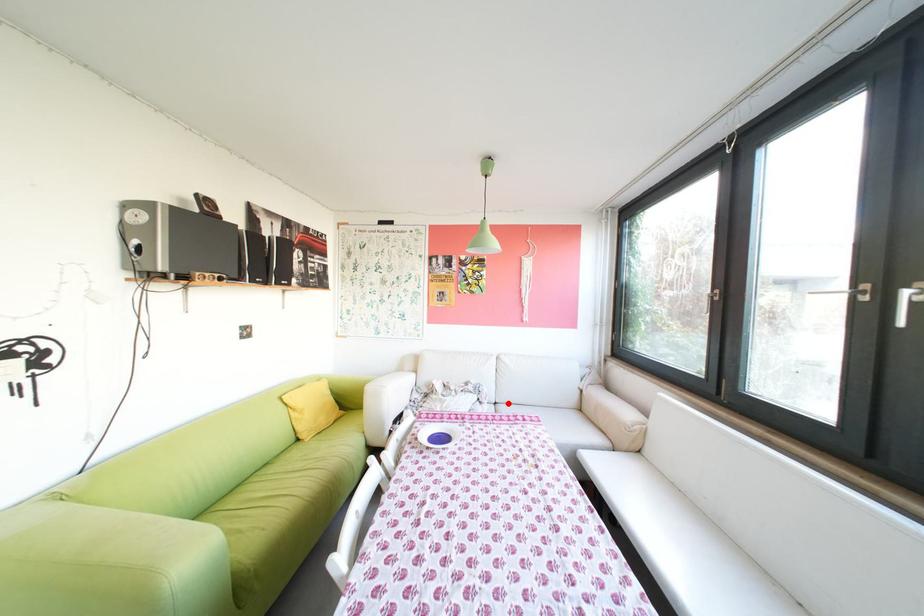
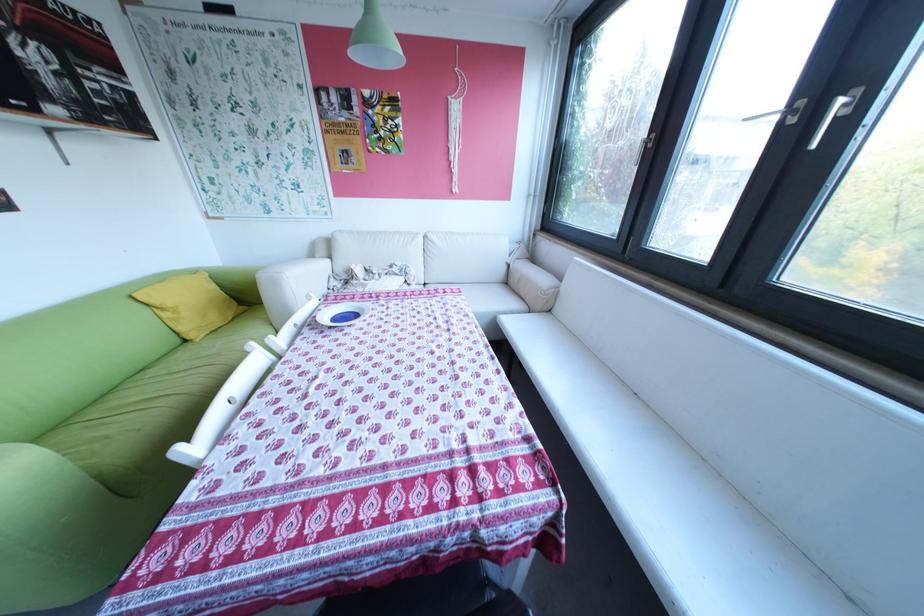
In the second image, find the point that corresponds to the highlighted location in the first image.

(438, 284)